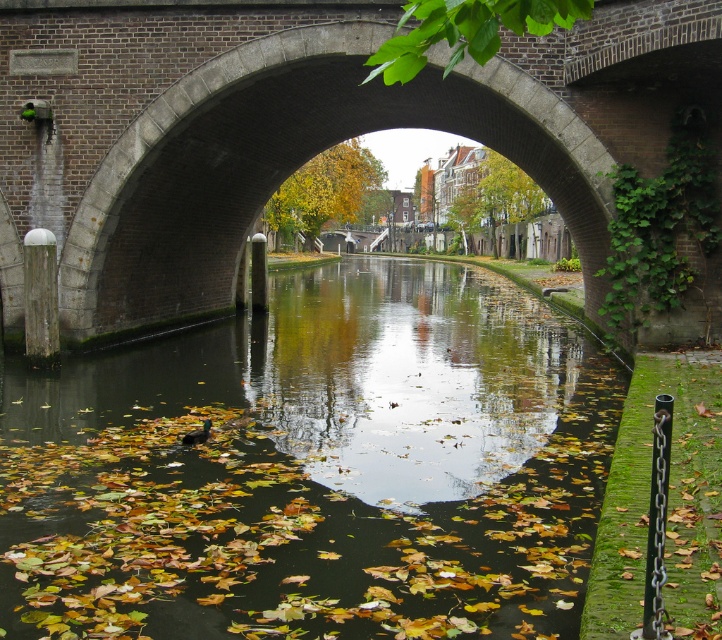
Does green mossy canal at center have a lesser height compared to brick stone bridge at center?

Yes.

Which is above, green mossy canal at center or brick stone bridge at center?

brick stone bridge at center

Describe the element at coordinates (316, 468) in the screenshot. The height and width of the screenshot is (640, 722). I see `green mossy canal at center` at that location.

You are a GUI agent. You are given a task and a screenshot of the screen. Output one action in this format:
    pyautogui.click(x=<x>, y=<y>)
    Task: Click on the green mossy canal at center
    
    Given the screenshot: What is the action you would take?
    pyautogui.click(x=316, y=468)